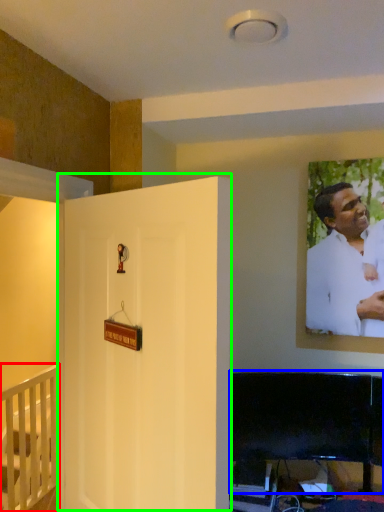
Question: Estimate the real-world distances between objects in this image. Which object is closer to furniture (highlighted by a red box), furniture (highlighted by a blue box) or door (highlighted by a green box)?

Choices:
 (A) furniture
 (B) door

Answer: (A)